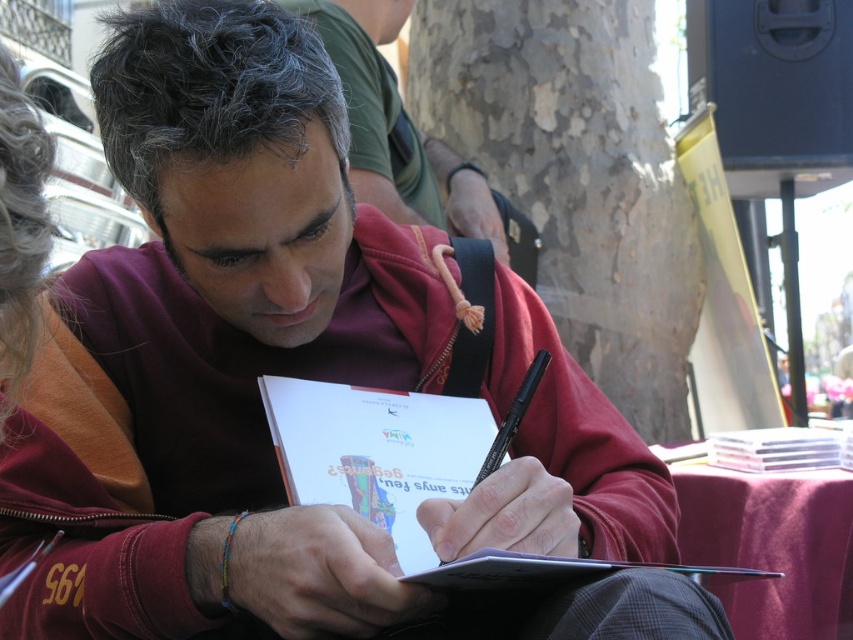
What is located at the coordinates point (410, 476) in the image?

The white paper notebook at center is located at point (410, 476).

You are a photographer trying to capture the man signing the paper. You notice two points on the paper at coordinates point (529, 561) and point (776, 435). Which point will appear larger in your photo?

Point (529, 561) is closer to the camera than point (776, 435), so it will appear larger in the photo.

You are standing in a park and see the smooth bark tree at center. If you walk straight ahead, will you encounter the tree before reaching the edge of the park?

The smooth bark tree at center is located at point (x=577, y=177), so it is positioned closer to the center of the park. Therefore, walking straight ahead, you would reach the tree before the park edge.